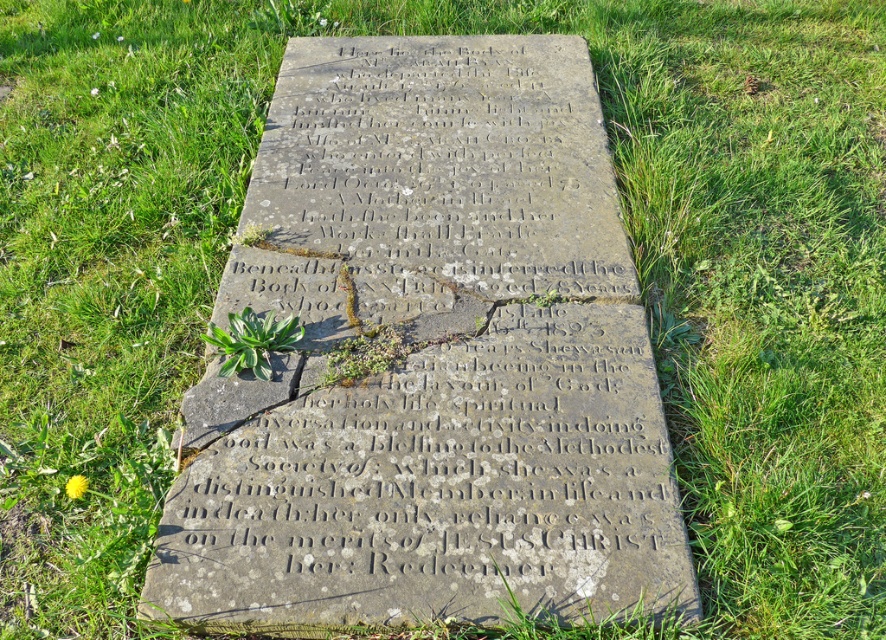
You are a gardener looking at the grave marker. You see a green leafy plant at center and a yellow petal at lower left. Which object is wider?

The green leafy plant at center is wider than the yellow petal at lower left.